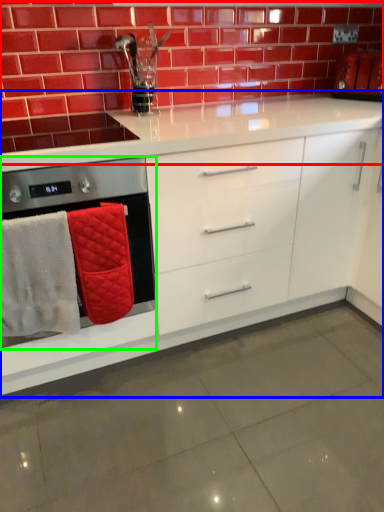
Question: Which object is the farthest from brickwork (highlighted by a red box)? Choose among these: cabinetry (highlighted by a blue box) or home appliance (highlighted by a green box).

Choices:
 (A) cabinetry
 (B) home appliance

Answer: (A)